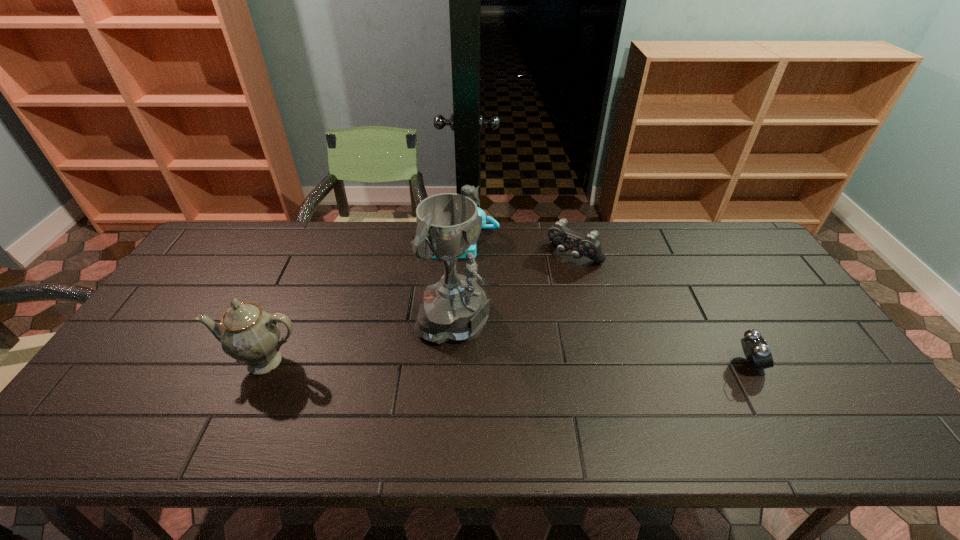
At what (x,y) coordinates should I click in order to perform the action: click on the leftmost object. Please return your answer as a coordinate pair (x, y). Looking at the image, I should click on (248, 334).

This screenshot has height=540, width=960. I want to click on chinaware, so click(x=248, y=334).

The width and height of the screenshot is (960, 540). Find the location of `alarm clock`. alarm clock is located at coordinates (758, 354).

Where is `the fourth object from left to right`? This screenshot has height=540, width=960. the fourth object from left to right is located at coordinates (589, 245).

Where is `telephone`? The width and height of the screenshot is (960, 540). telephone is located at coordinates (495, 225).

The width and height of the screenshot is (960, 540). I want to click on award, so click(456, 308).

You are a GUI agent. You are given a task and a screenshot of the screen. Output one action in this format:
    pyautogui.click(x=<x>, y=<y>)
    Task: Click on the blank space located 0.150m on the face of the rightmost object
    
    Given the screenshot: What is the action you would take?
    pyautogui.click(x=822, y=364)

Image resolution: width=960 pixels, height=540 pixels. I want to click on vacant space located 0.200m on the surface of the control with buttons, so click(x=526, y=305).

Image resolution: width=960 pixels, height=540 pixels. Identify the location of free region located 0.250m on the surface of the control with buttons. (516, 315).

Locate an element on the screen. The width and height of the screenshot is (960, 540). vacant position located on the surface of the control with buttons is located at coordinates (505, 328).